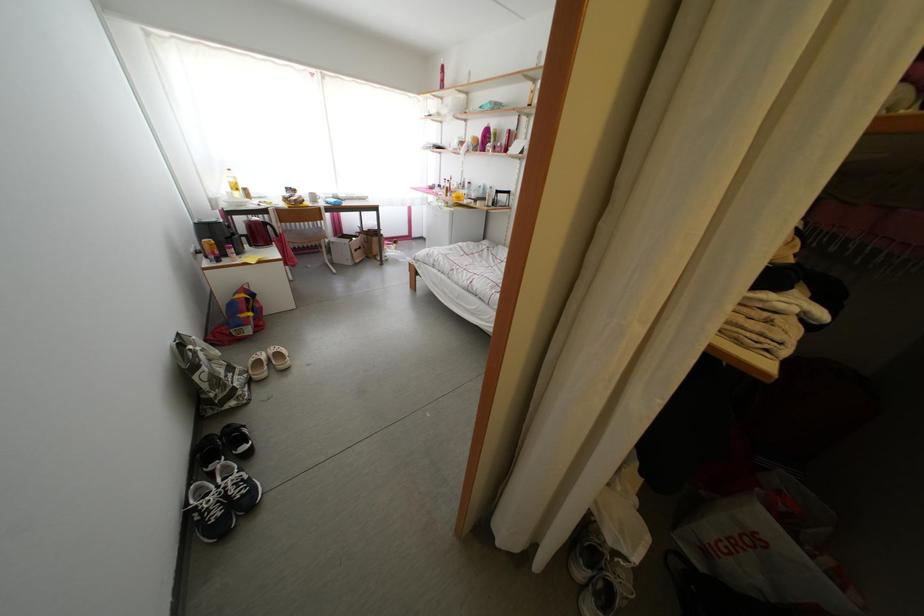
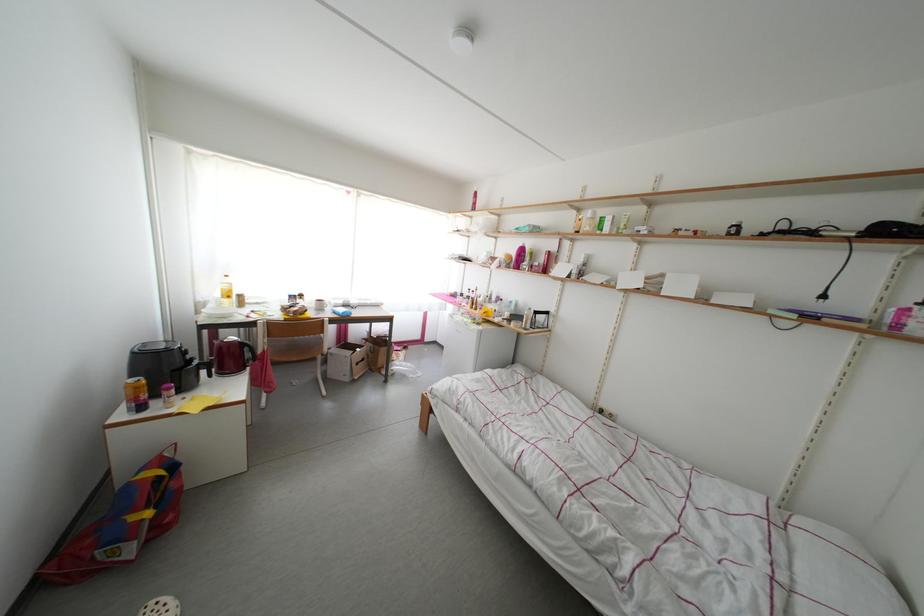
The images are taken continuously from a first-person perspective. In which direction are you moving?

The cameraman walked toward left, forward.